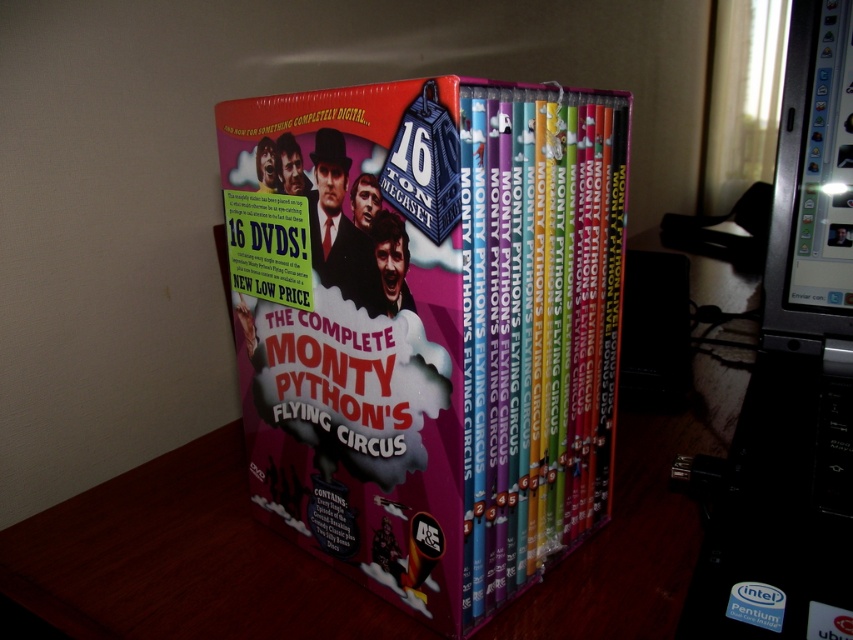
You are organizing a media collection and need to place the pink cardboard box at center and the black plastic monitor at upper right on a shelf. The shelf has a maximum length of 12 inches. Can both items fit side by side without overlapping?

The pink cardboard box at center is 8.64 inches from the black plastic monitor at upper right. Since the total distance between them is less than the shelf length of 12 inches, both items can fit side by side without overlapping.

You are organizing DVDs on a shelf and need to place the pink cardboard box at center. Where should you place it?

The pink cardboard box at center should be placed at the coordinates point (428,326).